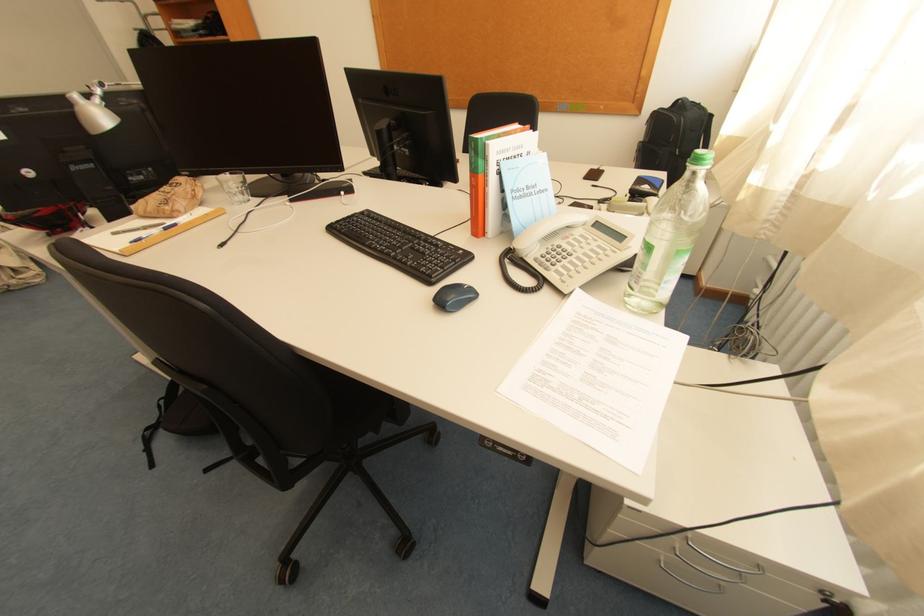
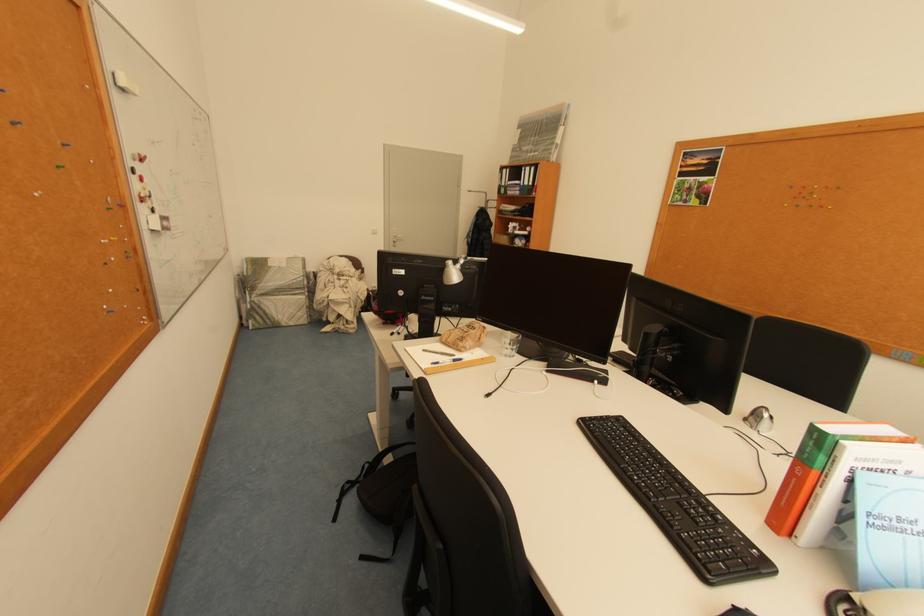
Where in the second image is the point corresponding to (x=241, y=206) from the first image?

(508, 355)